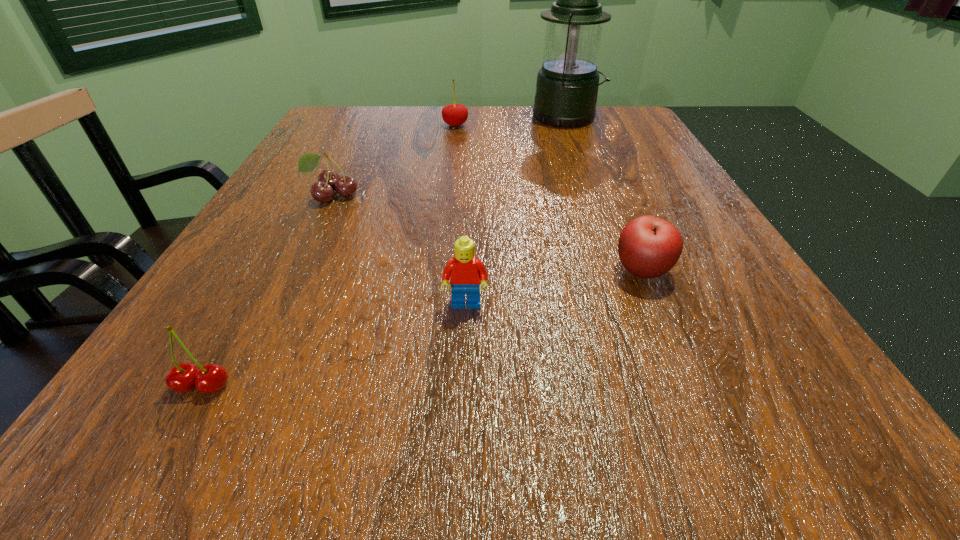
This screenshot has height=540, width=960. Identify the location of vacant area that satisfies the following two spatial constraints: 1. on the leaves of the fourth farthest object; 2. on the left side of the fourth nearest object. (295, 271).